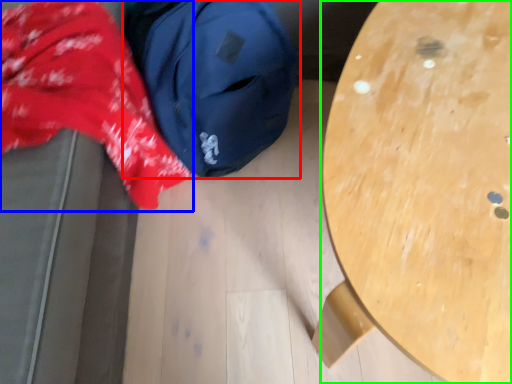
Question: Which is nearer to the backpack (highlighted by a red box)? clothing (highlighted by a blue box) or table (highlighted by a green box).

Choices:
 (A) clothing
 (B) table

Answer: (A)